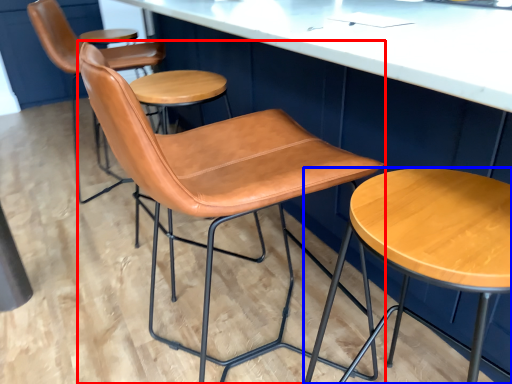
Question: Which object appears closest to the camera in this image, chair (highlighted by a red box) or stool (highlighted by a blue box)?

Choices:
 (A) chair
 (B) stool

Answer: (B)